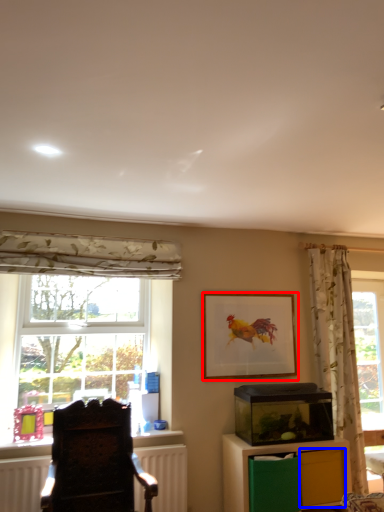
Question: Among these objects, which one is farthest to the camera, picture frame (highlighted by a red box) or drawer (highlighted by a blue box)?

Choices:
 (A) picture frame
 (B) drawer

Answer: (A)